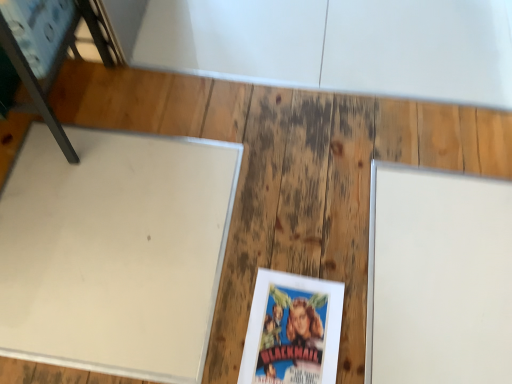
Find the location of a particular element. Image resolution: width=512 pixels, height=384 pixels. vacant area that lies between matte paper book at center and white matte board at right is located at coordinates (327, 236).